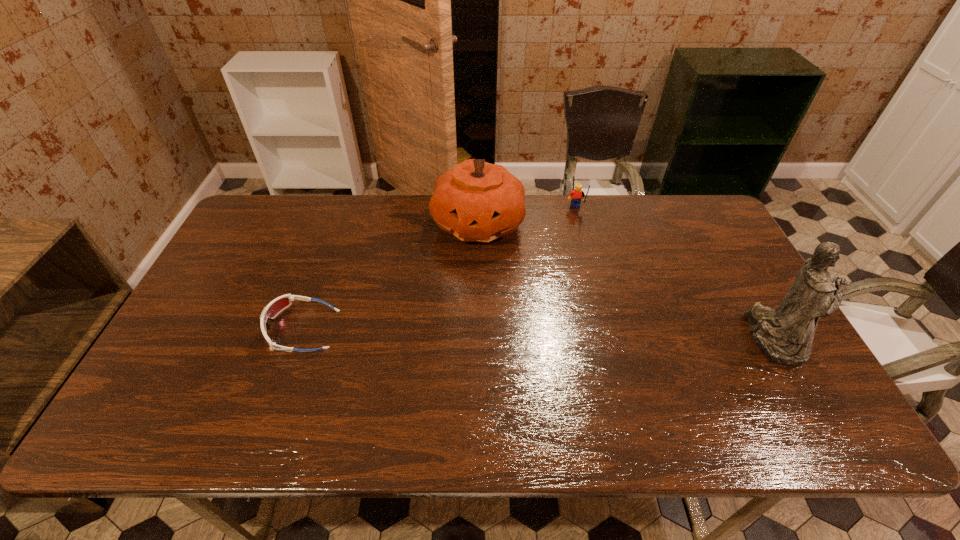
Where is `free space between the shortest object and the rightmost object`? free space between the shortest object and the rightmost object is located at coordinates [x=538, y=334].

You are a GUI agent. You are given a task and a screenshot of the screen. Output one action in this format:
    pyautogui.click(x=<x>, y=<y>)
    Task: Click on the vacant point located between the rightmost object and the goggles
    
    Given the screenshot: What is the action you would take?
    pyautogui.click(x=538, y=334)

Where is `vacant point located between the second tallest object and the tallest object`? The width and height of the screenshot is (960, 540). vacant point located between the second tallest object and the tallest object is located at coordinates (626, 281).

You are a GUI agent. You are given a task and a screenshot of the screen. Output one action in this format:
    pyautogui.click(x=<x>, y=<y>)
    Task: Click on the empty space that is in between the Lego and the rightmost object
    This screenshot has height=540, width=960.
    Given the screenshot: What is the action you would take?
    pyautogui.click(x=675, y=274)

Where is `free area in between the third object from right to left and the third object from left to right`? The height and width of the screenshot is (540, 960). free area in between the third object from right to left and the third object from left to right is located at coordinates (527, 217).

Find the location of a particular element. vacant space in between the goggles and the third shortest object is located at coordinates (390, 276).

Identify the location of vacant point located between the figurine and the pumpkin. This screenshot has width=960, height=540. (626, 281).

The width and height of the screenshot is (960, 540). What are the coordinates of `the closest object to the third object from left to right` in the screenshot? It's located at (476, 201).

Select which object appears as the second closest to the figurine. Please provide its 2D coordinates. Your answer should be formatted as a tuple, i.e. [(x, y)], where the tuple contains the x and y coordinates of a point satisfying the conditions above.

[(476, 201)]

Identify the location of vacant space that satisfies the following two spatial constraints: 1. on the front side of the figurine; 2. on the front-facing side of the third shortest object. (477, 339).